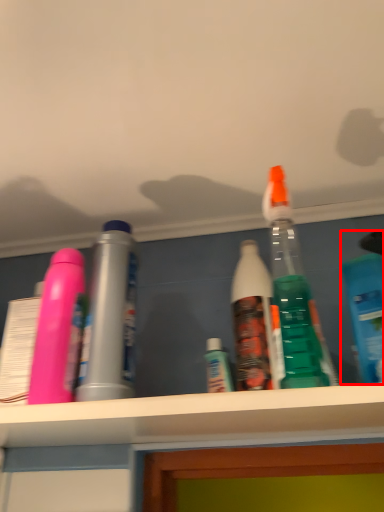
Question: From the image's perspective, what is the correct spatial positioning of bottle (annotated by the red box) in reference to bottle?

Choices:
 (A) above
 (B) below

Answer: (A)